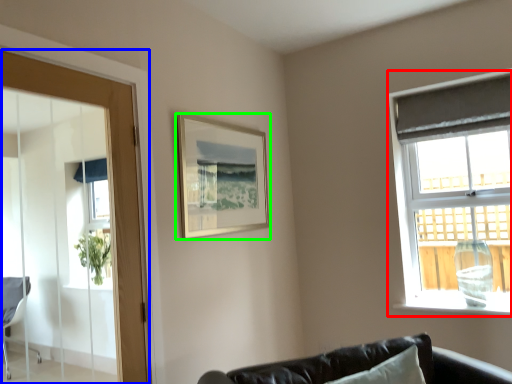
Question: Estimate the real-world distances between objects in this image. Which object is farther from window (highlighted by a red box), door (highlighted by a blue box) or picture frame (highlighted by a green box)?

Choices:
 (A) door
 (B) picture frame

Answer: (A)